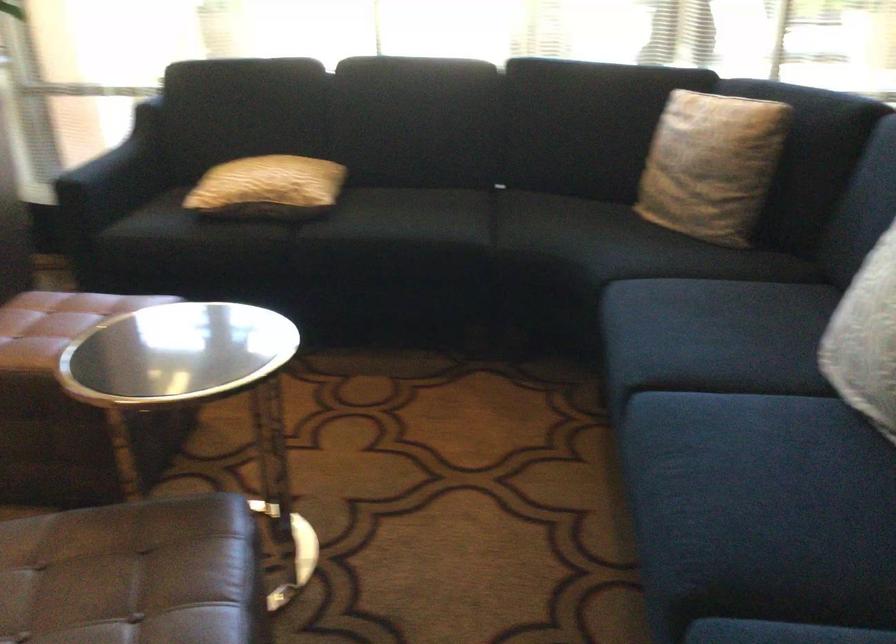
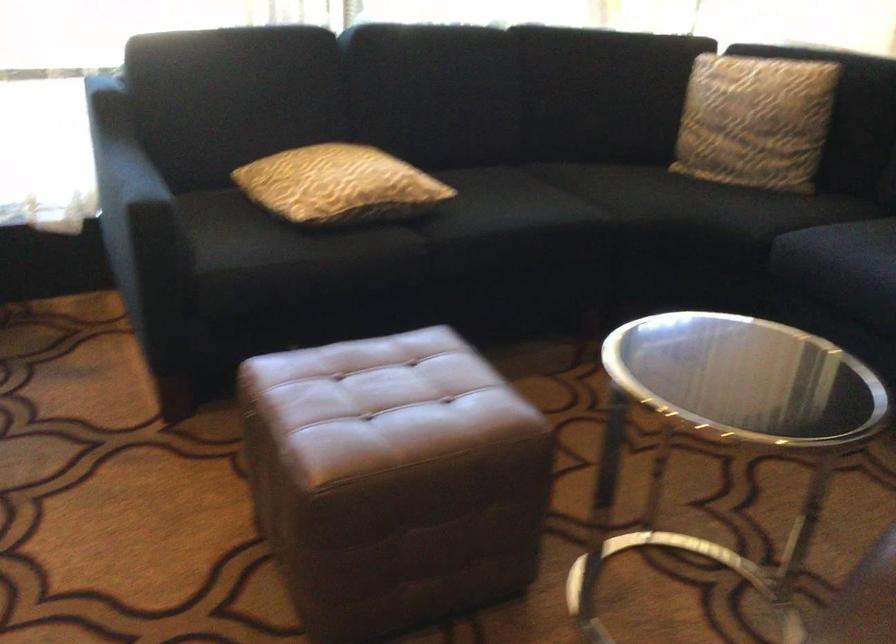
Locate, in the second image, the point that corresponds to (685,167) in the first image.

(754, 120)